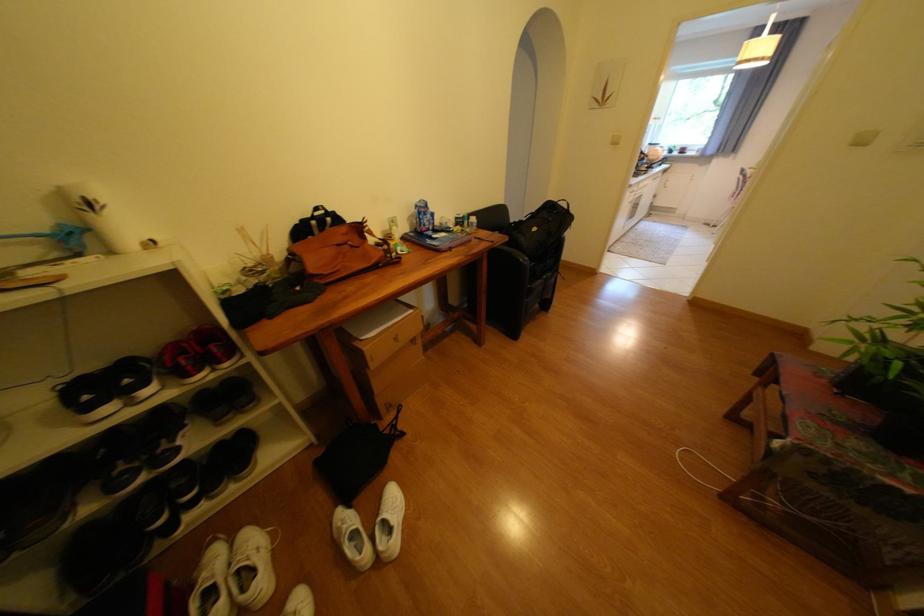
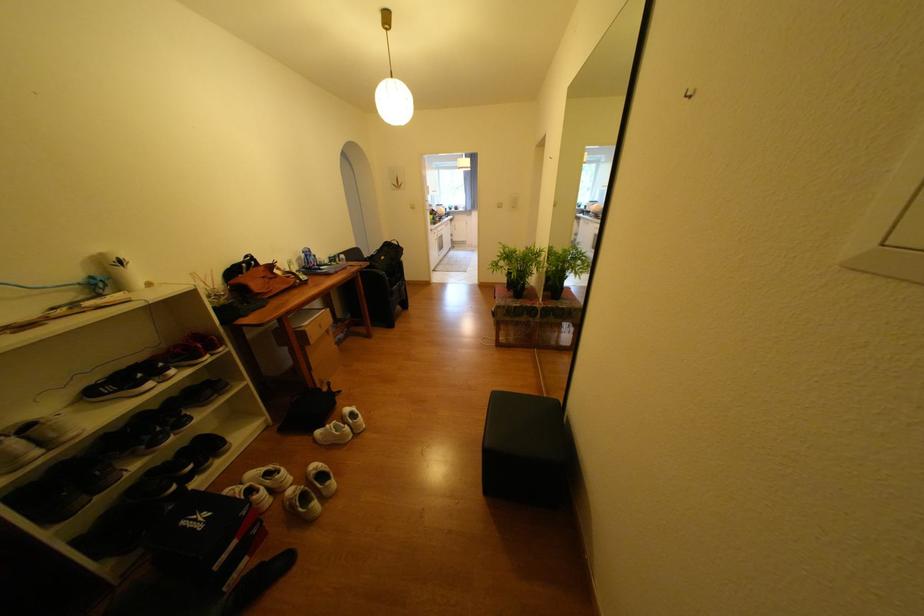
Where in the second image is the point corresponding to (351,229) from the first image?

(271, 269)